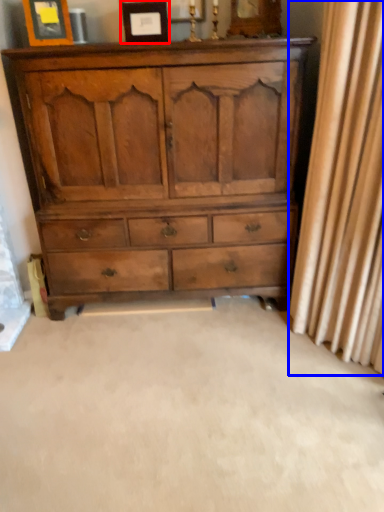
Question: Which object is closer to the camera taking this photo, picture frame (highlighted by a red box) or curtain (highlighted by a blue box)?

Choices:
 (A) picture frame
 (B) curtain

Answer: (B)